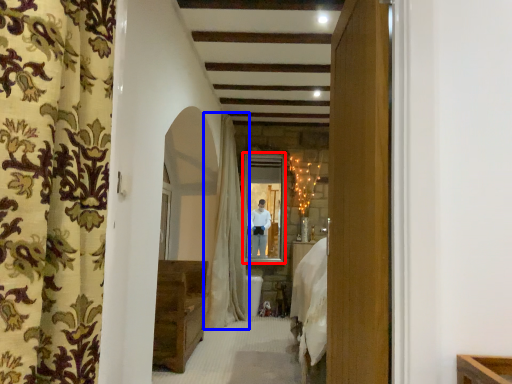
Question: Among these objects, which one is farthest to the camera, window (highlighted by a red box) or curtain (highlighted by a blue box)?

Choices:
 (A) window
 (B) curtain

Answer: (A)